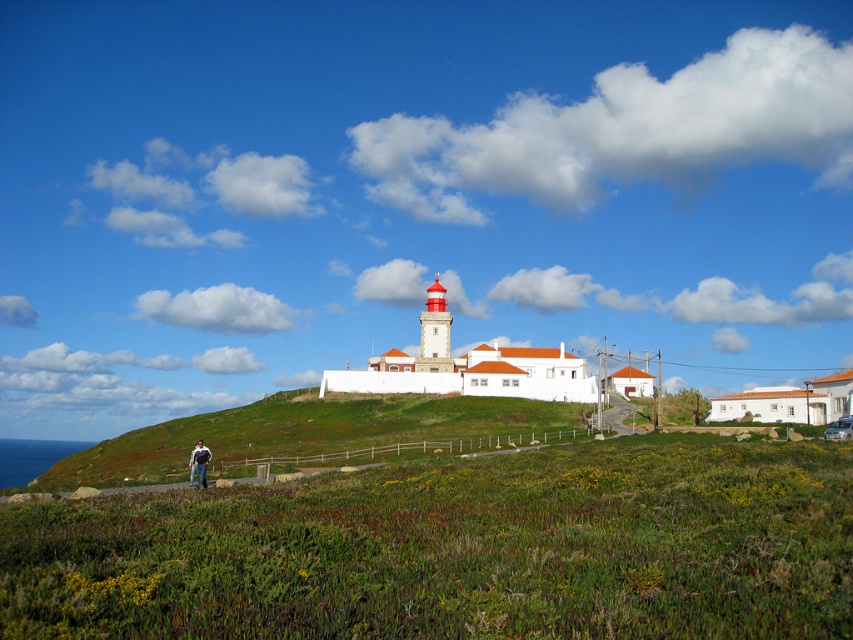
You are standing at the bottom of the hill in the coastal scene and see both the green grassy hillside at lower left and the blue jeans at lower left. Which object is closer to your feet?

The green grassy hillside at lower left is below blue jeans at lower left, so the green grassy hillside at lower left is closer to your feet.

In the scene shown: You are standing at the bottom of the hill and see the green grassy hillside at lower left and the blue jeans at lower left. Which object is closer to your left side?

The blue jeans at lower left is positioned on the left side of green grassy hillside at lower left, so the blue jeans at lower left is closer to your left side.